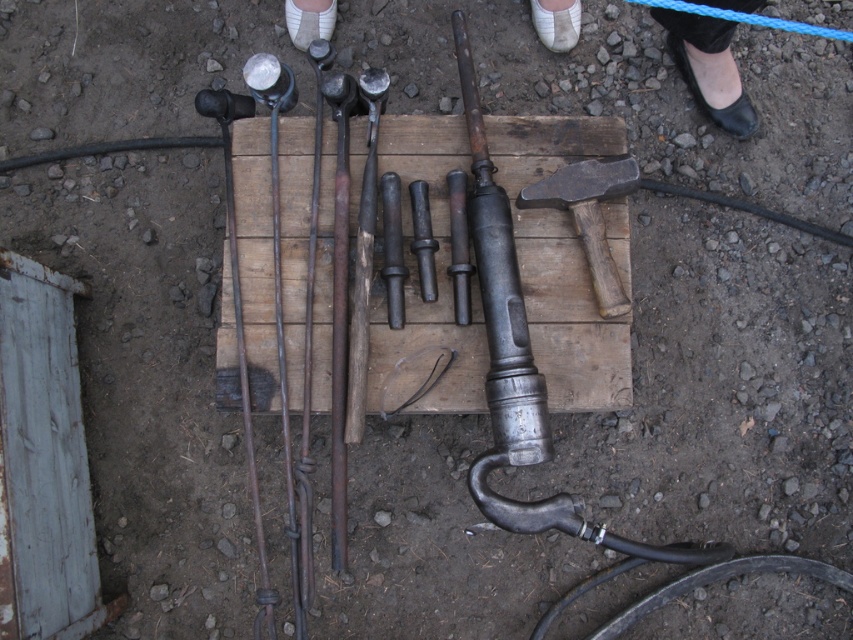
Who is positioned more to the left, white leather shoe at upper center or dark gray wooden hammer at center?

From the viewer's perspective, dark gray wooden hammer at center appears more on the left side.

Does white leather shoe at upper center appear under dark gray wooden hammer at center?

No, white leather shoe at upper center is not below dark gray wooden hammer at center.

Who is more distant from viewer, (741, 138) or (585, 260)?

The point (741, 138) is behind.

Locate an element on the screen. white leather shoe at upper center is located at coordinates click(x=708, y=68).